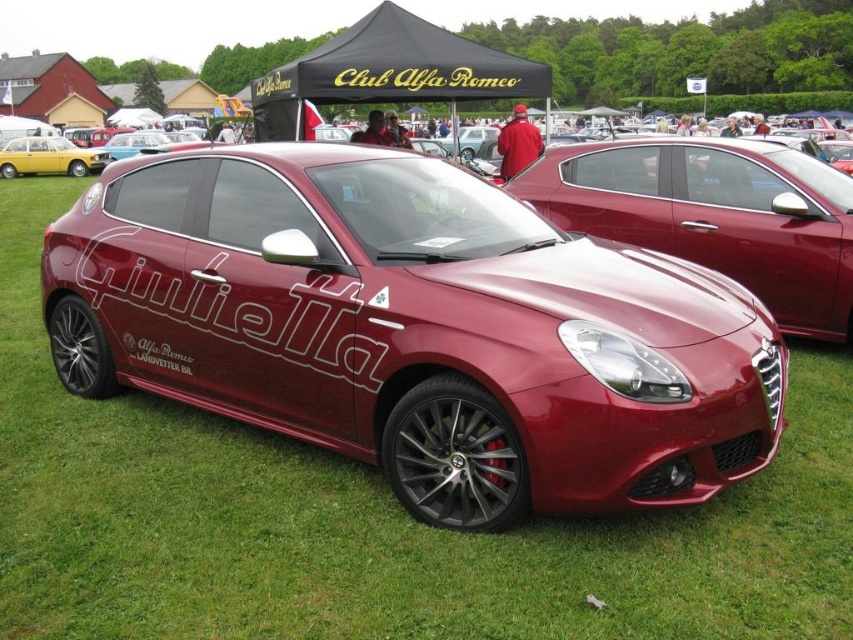
You are a photographer at the car show. You need to capture both the glossy metallic car at center and the yellow matte hatchback at left in a single frame. Given their sizes, which car should you position closer to the camera to ensure both fit in the shot?

Since the glossy metallic car at center occupies less space than the yellow matte hatchback at left, you should position the yellow matte hatchback at left closer to the camera to ensure both fit in the shot.

Based on the photo, you are standing in front of the glossy metallic car at center and want to walk to the yellow matte hatchback at left. Which direction should you face to move towards it?

You should face towards the left direction because the yellow matte hatchback at left is positioned to the left side of the glossy metallic car at center.